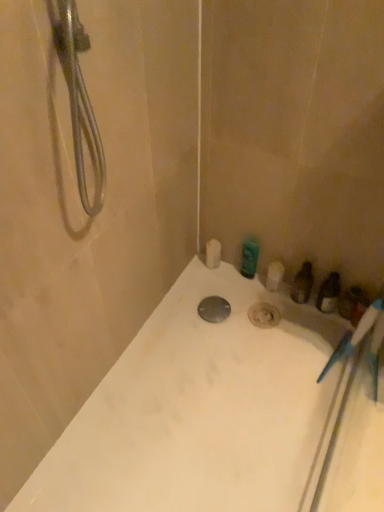
I want to click on vacant space in front of white matte toilet paper at upper center, so click(x=211, y=297).